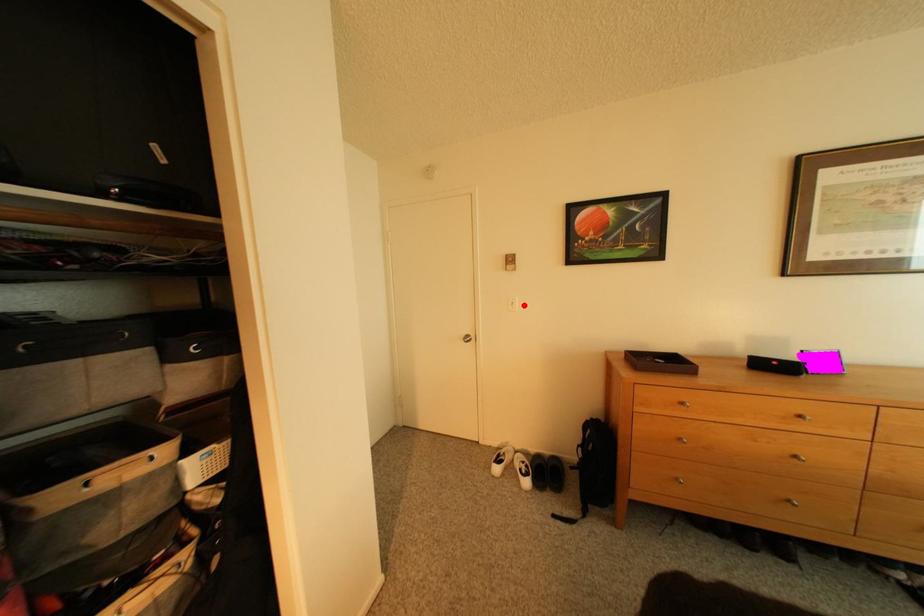
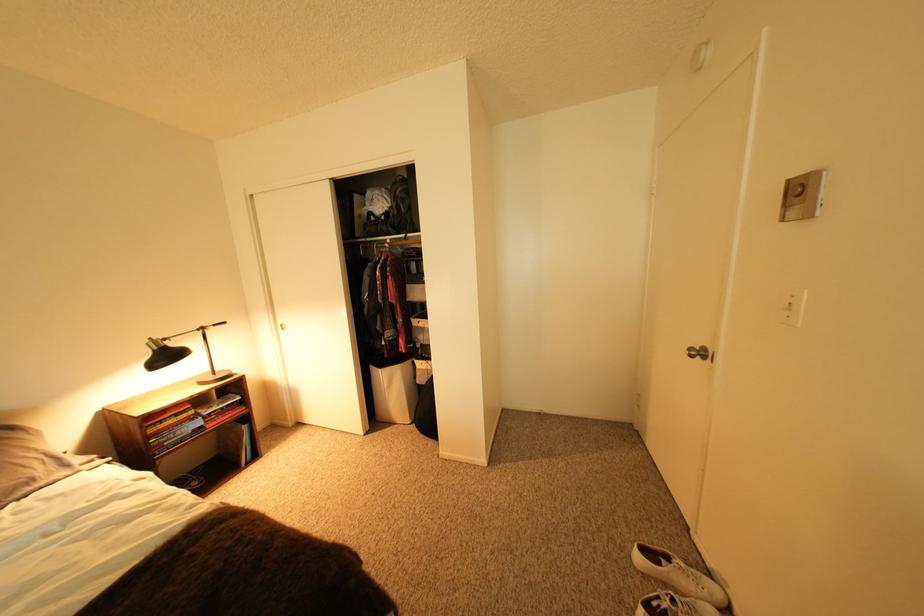
The point at the highlighted location is marked in the first image. Where is the corresponding point in the second image?

(799, 307)